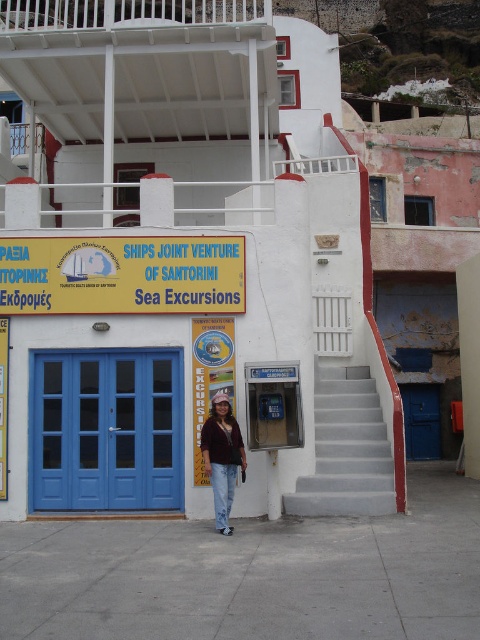
You are standing at the entrance of the building and want to reach the second floor balcony. The entrance has two blue double doors. Where are the gray concrete stairs at center located relative to the entrance?

The gray concrete stairs at center are located at point (346, 449) relative to the entrance.

You are a tourist visiting Santorini and want to take a photo of the yellow plastic sign at center and the denim jacket at center. From your current position, which object should you focus on first to ensure both are in the frame without moving the camera?

The denim jacket at center is behind the yellow plastic sign at center, so you should focus on the yellow plastic sign at center first to ensure both are visible in the frame without obstruction.